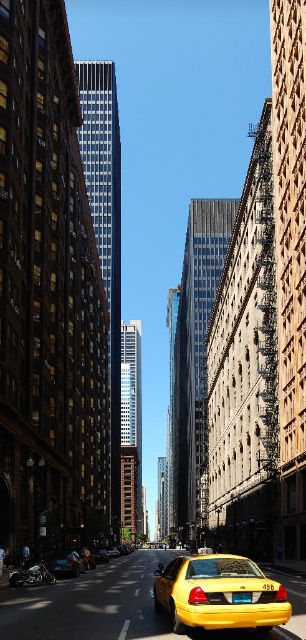
Question: Does yellow matte taxi at lower center appear on the left side of shiny black car at lower left?

Choices:
 (A) no
 (B) yes

Answer: (A)

Question: Which object appears farthest from the camera in this image?

Choices:
 (A) yellow matte taxi at center
 (B) shiny black car at lower left

Answer: (A)

Question: Estimate the real-world distances between objects in this image. Which object is farther from the shiny black car at lower left?

Choices:
 (A) yellow matte taxi at lower center
 (B) yellow metallic taxi at center
 (C) yellow matte taxi at center

Answer: (C)

Question: Does yellow matte taxi at lower center have a lesser width compared to yellow metallic taxi at center?

Choices:
 (A) yes
 (B) no

Answer: (B)

Question: Where is yellow matte taxi at lower center located in relation to yellow matte taxi at center in the image?

Choices:
 (A) below
 (B) above

Answer: (B)

Question: Which of these objects is positioned farthest from the shiny black car at lower left?

Choices:
 (A) yellow matte taxi at center
 (B) yellow matte taxi at lower center
 (C) yellow metallic taxi at center

Answer: (A)